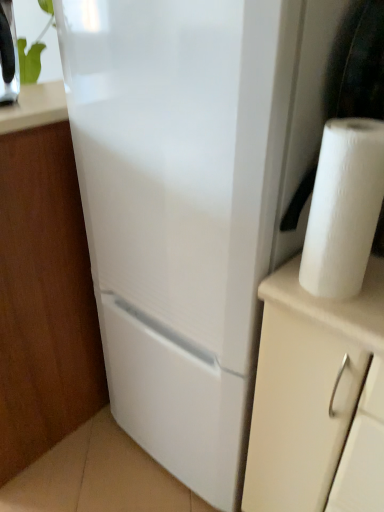
Image resolution: width=384 pixels, height=512 pixels. Describe the element at coordinates (343, 208) in the screenshot. I see `white paper at right` at that location.

This screenshot has height=512, width=384. Find the location of `white paper at right`. white paper at right is located at coordinates (343, 208).

Where is `green leafy plant at upper left`? green leafy plant at upper left is located at coordinates (29, 20).

Is white matte cabinet at lower left thinner than green leafy plant at upper left?

In fact, white matte cabinet at lower left might be wider than green leafy plant at upper left.

Is white matte cabinet at lower left not inside green leafy plant at upper left?

Yes.

Are white matte cabinet at lower left and green leafy plant at upper left making contact?

No, white matte cabinet at lower left is not with green leafy plant at upper left.

Is green leafy plant at upper left oriented away from white matte cabinet at lower left?

No, white matte cabinet at lower left is not at the back of green leafy plant at upper left.

From the image's perspective, is green leafy plant at upper left located beneath white matte cabinet at lower left?

Incorrect, from the image's perspective, green leafy plant at upper left is higher than white matte cabinet at lower left.

Does green leafy plant at upper left have a larger size compared to white matte cabinet at lower left?

Incorrect, green leafy plant at upper left is not larger than white matte cabinet at lower left.

Can you tell me how much green leafy plant at upper left and white matte cabinet at lower left differ in facing direction?

green leafy plant at upper left and white matte cabinet at lower left are facing 92.6 degrees away from each other.

Is white paper at right oriented away from white matte cabinet at lower left?

No, white paper at right is not facing away from white matte cabinet at lower left.

Where is `paper towel that appears on the right of white matte cabinet at lower left`? paper towel that appears on the right of white matte cabinet at lower left is located at coordinates (343, 208).

Can you confirm if white paper at right is smaller than white matte cabinet at lower left?

Correct, white paper at right occupies less space than white matte cabinet at lower left.

Which is less distant, (x=326, y=147) or (x=40, y=165)?

Point (x=326, y=147)

Between white matte cabinet at lower left and white paper at right, which one has less height?

Standing shorter between the two is white paper at right.

From a real-world perspective, between white matte cabinet at lower left and white paper at right, who is vertically lower?

white matte cabinet at lower left.

Is white matte cabinet at lower left looking in the opposite direction of white paper at right?

That's right, white matte cabinet at lower left is facing away from white paper at right.

Between white paper at right and green leafy plant at upper left, which one has more height?

white paper at right.

Between white paper at right and green leafy plant at upper left, which one has larger width?

green leafy plant at upper left is wider.

Who is taller, green leafy plant at upper left or white paper at right?

white paper at right is taller.

From the image's perspective, does green leafy plant at upper left appear higher than white paper at right?

Yes, from the image's perspective, green leafy plant at upper left is above white paper at right.

Is green leafy plant at upper left at the right side of white paper at right?

In fact, green leafy plant at upper left is to the left of white paper at right.

Locate an element on the screen. This screenshot has width=384, height=512. plant behind the white matte cabinet at lower left is located at coordinates (29, 20).

The width and height of the screenshot is (384, 512). In the image, there is a green leafy plant at upper left. Identify the location of cabinetry below it (from a real-world perspective). (44, 298).

Which object lies further to the anchor point white matte cabinet at lower left, white paper at right or green leafy plant at upper left?

green leafy plant at upper left lies further to white matte cabinet at lower left than the other object.

Based on their spatial positions, is green leafy plant at upper left or white paper at right closer to white matte cabinet at lower left?

white paper at right is positioned closer to the anchor white matte cabinet at lower left.

When comparing their distances from green leafy plant at upper left, does white paper at right or white matte cabinet at lower left seem further?

The object further to green leafy plant at upper left is white paper at right.

From the picture: Looking at the image, which one is located closer to green leafy plant at upper left, white matte cabinet at lower left or white paper at right?

white matte cabinet at lower left.

Based on their spatial positions, is white matte cabinet at lower left or green leafy plant at upper left closer to white paper at right?

white matte cabinet at lower left is positioned closer to the anchor white paper at right.

Consider the image. Looking at the image, which one is located closer to white paper at right, green leafy plant at upper left or white matte cabinet at lower left?

white matte cabinet at lower left is closer to white paper at right.

Where is `plant situated between white matte cabinet at lower left and white paper at right from left to right`? This screenshot has width=384, height=512. plant situated between white matte cabinet at lower left and white paper at right from left to right is located at coordinates (29, 20).